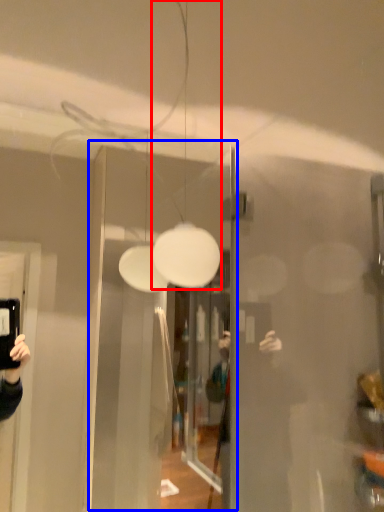
Question: Which of the following is the closest to the observer, light fixture (highlighted by a red box) or glass door (highlighted by a blue box)?

Choices:
 (A) light fixture
 (B) glass door

Answer: (B)